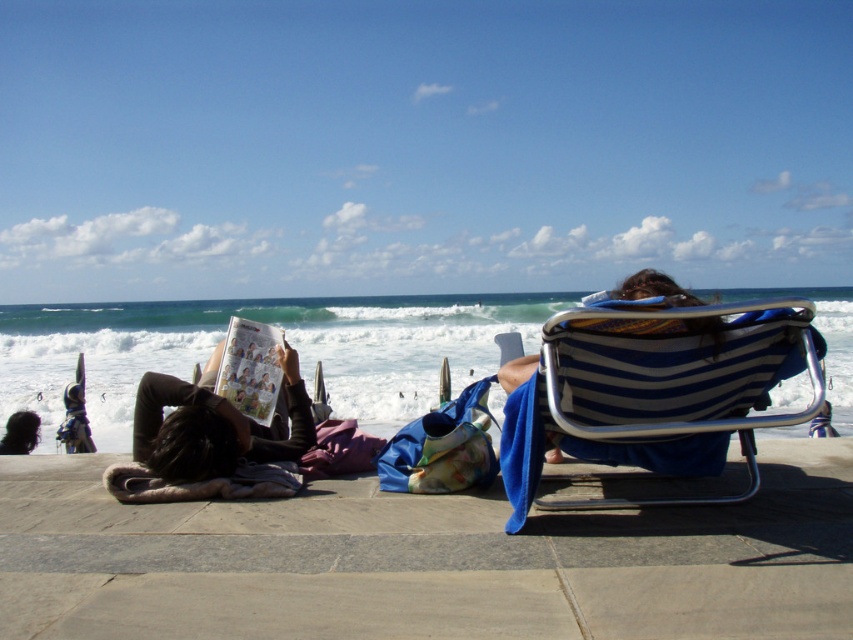
How distant is beige concrete sidewalk at lower center from blue striped chair at center?

5.25 feet

Who is more distant from viewer, (80, 490) or (636, 273)?

The point (80, 490) is behind.

Describe the element at coordinates (425, 561) in the screenshot. I see `beige concrete sidewalk at lower center` at that location.

You are a GUI agent. You are given a task and a screenshot of the screen. Output one action in this format:
    pyautogui.click(x=<x>, y=<y>)
    Task: Click on the beige concrete sidewalk at lower center
    The width and height of the screenshot is (853, 640).
    Given the screenshot: What is the action you would take?
    pyautogui.click(x=425, y=561)

Between point (376, 614) and point (270, 353), which one is positioned in front?

Positioned in front is point (376, 614).

Between point (141, 586) and point (271, 371), which one is positioned behind?

Point (271, 371)

Which is in front, point (434, 570) or point (227, 365)?

Positioned in front is point (434, 570).

The image size is (853, 640). What are the coordinates of `beige concrete sidewalk at lower center` in the screenshot? It's located at (425, 561).

Between point (561, 388) and point (252, 355), which one is positioned in front?

Point (561, 388) is in front.

Is point (582, 397) closer to viewer compared to point (241, 332)?

Yes, point (582, 397) is in front of point (241, 332).

Locate an element on the screen. blue striped fabric beach chair at right is located at coordinates (666, 380).